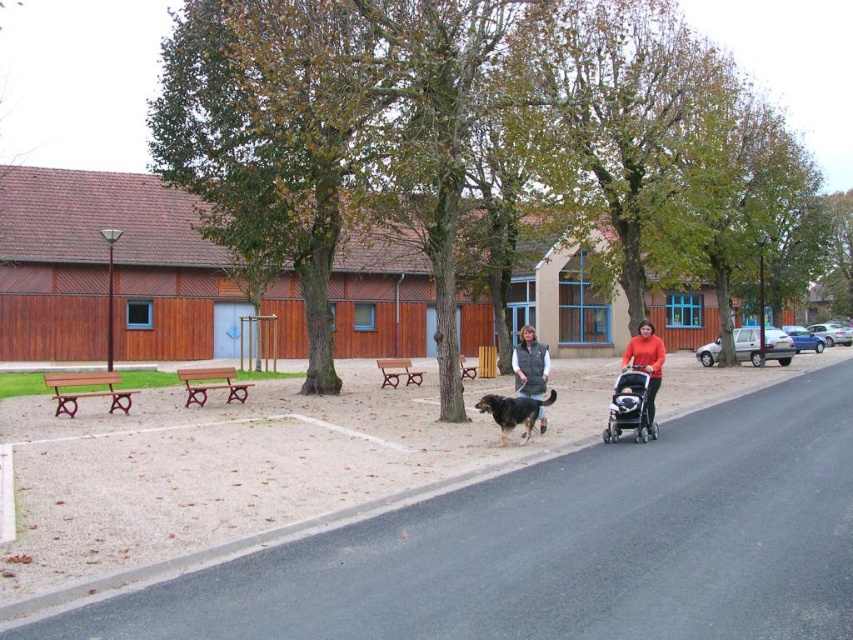
You are a hiker who wants to wear either the dark gray fleece vest at center or the matte orange sweater at center. Which clothing item has a larger width?

The dark gray fleece vest at center might be wider than matte orange sweater at center, so it could be the better choice if you need more coverage.

You are a parent pushing a silver metallic stroller at right and want to place a matte orange sweater at center on the stroller. Can you reach the sweater without moving the stroller?

The distance between the silver metallic stroller at right and the matte orange sweater at center is 26.50 inches. Since the stroller is stationary, you can reach the sweater if your arm length exceeds 26.50 inches. However, typical adult arm reach is around 28 inches, so it might be possible but could be slightly challenging.

You are standing at the bottom left of the image, facing the road. There is a point marked at coordinates (646, 364). What object is located at that point?

The object at point (646, 364) is a matte orange sweater at center.